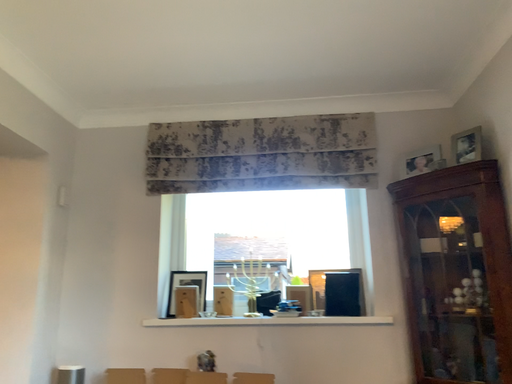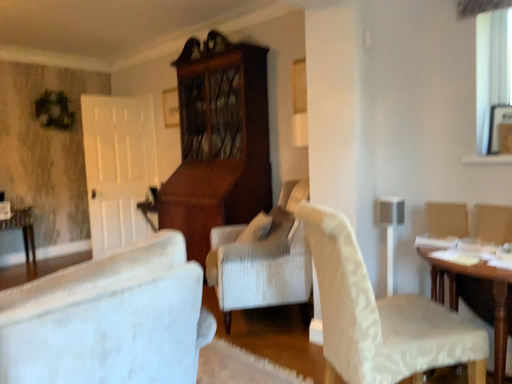
Question: How did the camera likely rotate when shooting the video?

Choices:
 (A) rotated right
 (B) rotated left

Answer: (B)